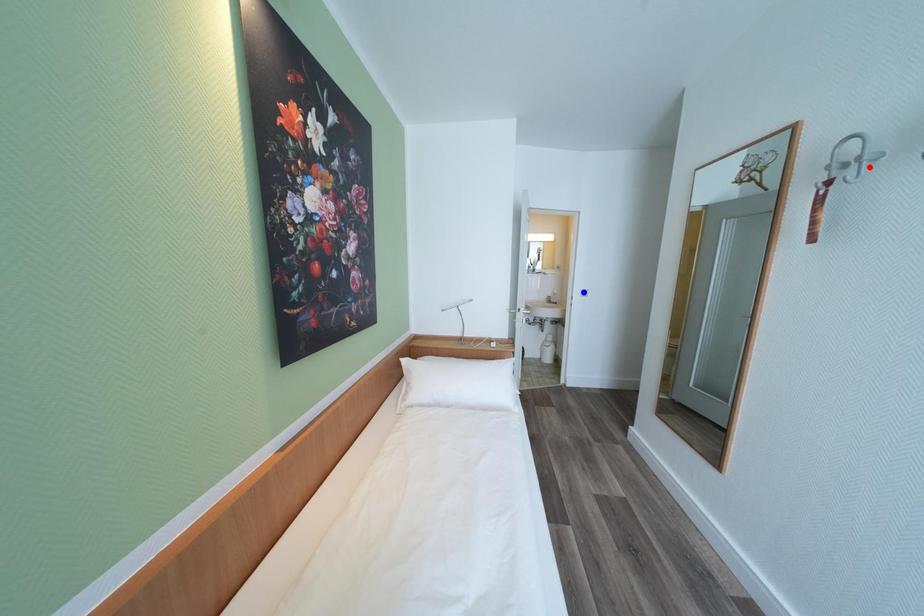
Question: Which of the two points in the image is closer to the camera?

Choices:
 (A) Blue point is closer.
 (B) Red point is closer.

Answer: (B)